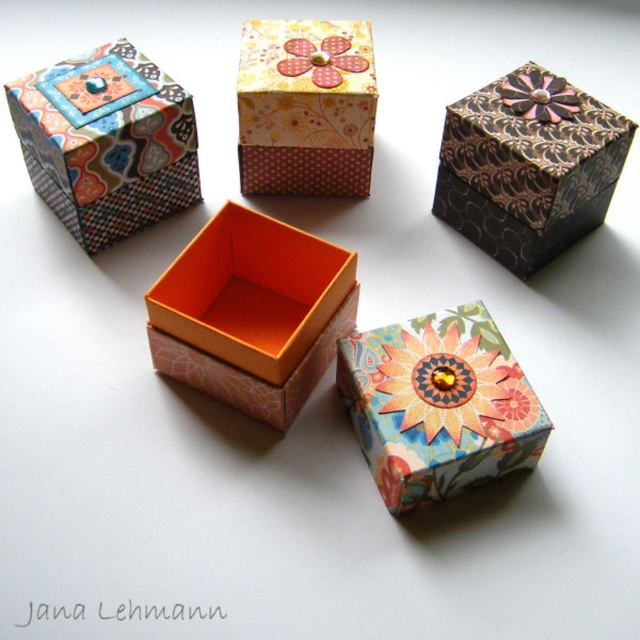
You are organizing a gift set and need to place the orange matte box at center and the pink fabric flower at upper center in a specific arrangement. According to the image, which object is positioned to the left of the other?

The orange matte box at center is to the left of the pink fabric flower at upper center.

You are an interior designer planning to place a decorative item on a shelf. You have a small statue that is 0.2 meters wide. The shelf has a maximum load capacity of 1.5 kilograms. Can you place the brown textured box at upper right on the shelf without exceeding the weight limit and ensuring it fits within the space?

The brown textured box at upper right weighs 1.4 kilograms and has a width of 0.25 meters. Since the shelf can hold up to 1.5 kilograms, placing the box would be within the weight limit. However, the box is 0.25 meters wide, which is wider than the 0.2 meters available space. Therefore, it won not fit.